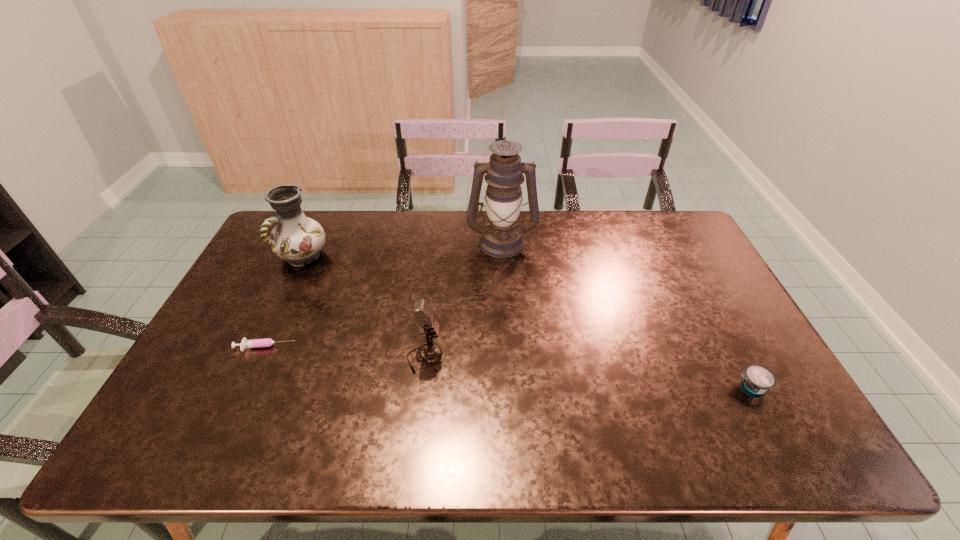
The width and height of the screenshot is (960, 540). What are the coordinates of `the tallest object` in the screenshot? It's located at (502, 237).

Identify the location of oil lamp. (502, 237).

Where is `the fourth shortest object`? This screenshot has height=540, width=960. the fourth shortest object is located at coordinates (297, 239).

Identify the location of the third object from right to left. (430, 354).

What are the coordinates of `the third tallest object` in the screenshot? It's located at (430, 354).

At what (x,y) coordinates should I click in order to perform the action: click on the nearest object. Please return your answer as a coordinate pair (x, y). Looking at the image, I should click on (757, 379).

Find the location of a particular element. This screenshot has width=960, height=540. yogurt is located at coordinates (757, 379).

Where is `the shortest object`? The height and width of the screenshot is (540, 960). the shortest object is located at coordinates (266, 342).

You are a GUI agent. You are given a task and a screenshot of the screen. Output one action in this format:
    pyautogui.click(x=<x>, y=<y>)
    Task: Click on the free space located on the right of the oil lamp
    
    Given the screenshot: What is the action you would take?
    pyautogui.click(x=608, y=242)

Locate an element on the screen. Image resolution: width=960 pixels, height=540 pixels. free spot located on the front of the vase is located at coordinates (251, 367).